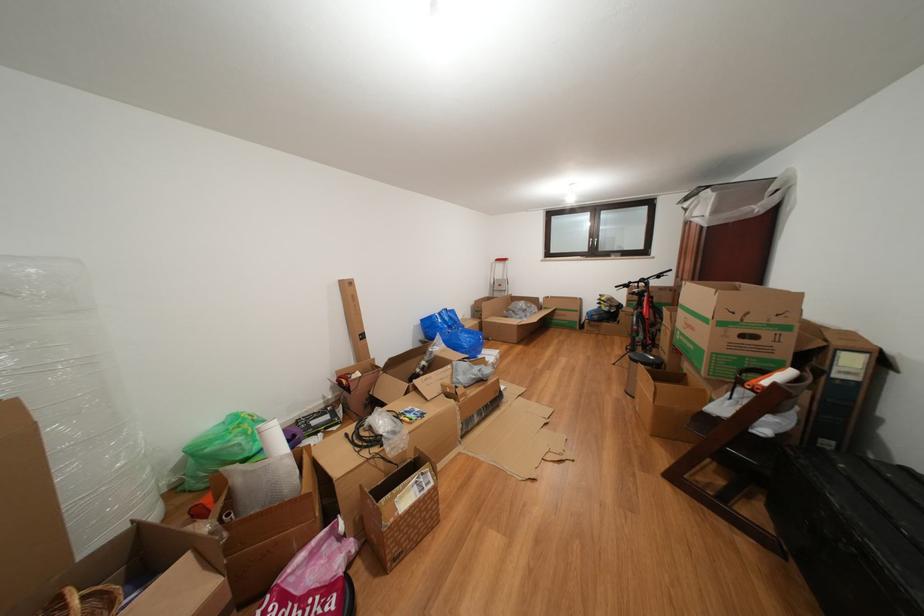
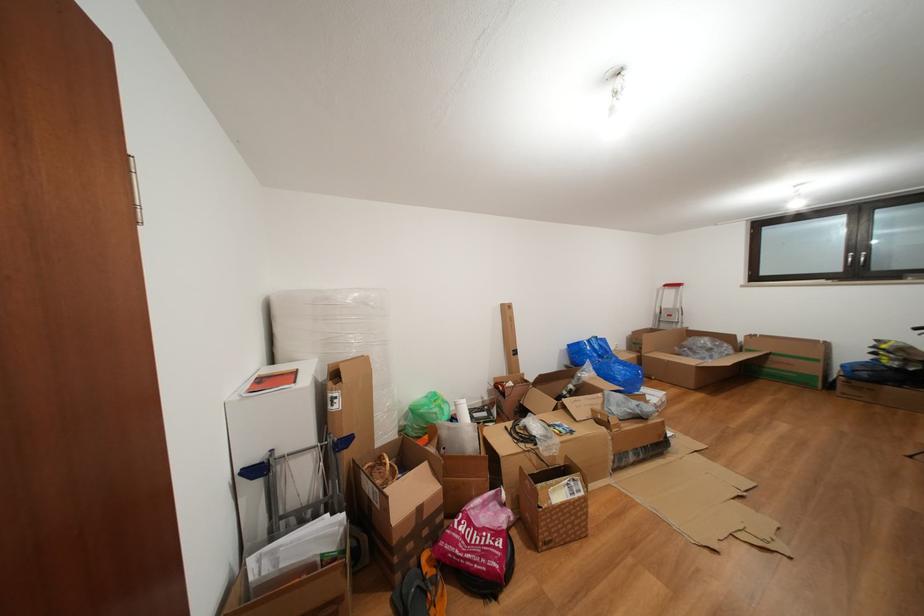
The point at (x=447, y=318) is marked in the first image. Where is the corresponding point in the second image?

(597, 346)